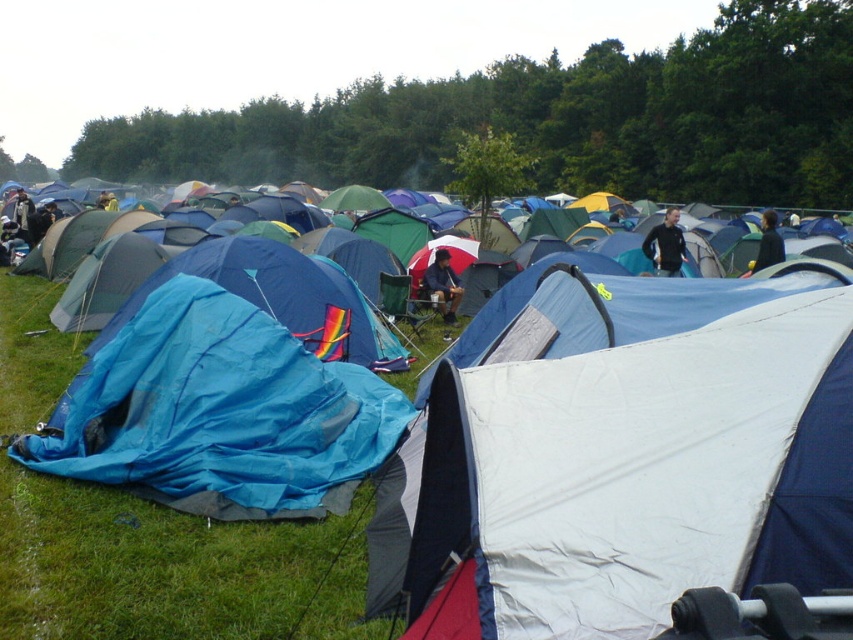
Question: Is blue tarp at center positioned before dark blue fabric jacket at upper right?

Choices:
 (A) yes
 (B) no

Answer: (A)

Question: Can you confirm if blue tarp at center is smaller than dark blue fabric jacket at upper right?

Choices:
 (A) no
 (B) yes

Answer: (B)

Question: Which object is closer to the camera taking this photo?

Choices:
 (A) black matte jacket at center
 (B) blue tarp at center
 (C) dark blue fabric jacket at upper right

Answer: (B)

Question: Which object is the closest to the dark blue fabric jacket at upper right?

Choices:
 (A) blue fabric tent at lower left
 (B) blue tarp at center
 (C) black matte jacket at center

Answer: (C)

Question: Can you confirm if blue tarp at center is positioned to the left of blue fabric tent at lower left?

Choices:
 (A) no
 (B) yes

Answer: (B)

Question: Estimate the real-world distances between objects in this image. Which object is farther from the black matte jacket at center?

Choices:
 (A) dark blue fabric jacket at upper right
 (B) blue fabric tent at lower left
 (C) matte blue tent at center

Answer: (B)